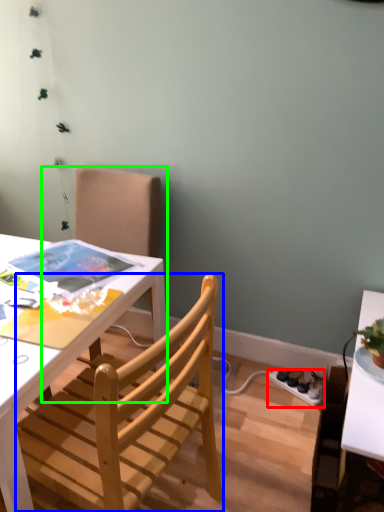
Question: Estimate the real-world distances between objects in this image. Which object is farther from power outlet (highlighted by a red box), chair (highlighted by a blue box) or chair (highlighted by a green box)?

Choices:
 (A) chair
 (B) chair

Answer: (B)